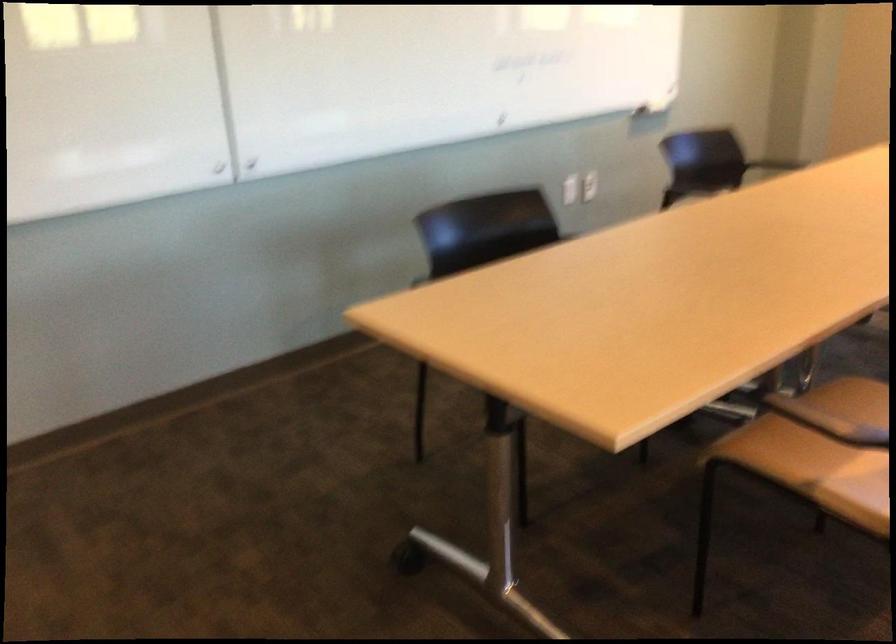
Locate an element on the screen. This screenshot has height=644, width=896. chair armrest is located at coordinates (814, 418).